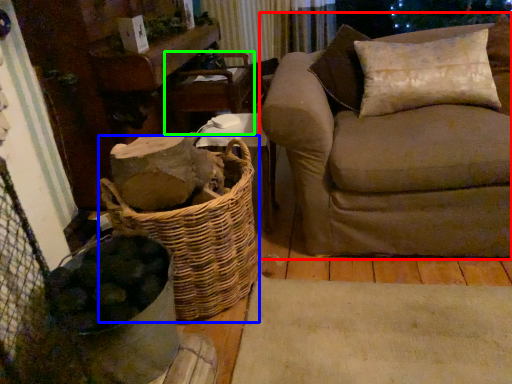
Question: Which object is the closest to the studio couch (highlighted by a red box)? Choose among these: basket (highlighted by a blue box) or armchair (highlighted by a green box).

Choices:
 (A) basket
 (B) armchair

Answer: (A)